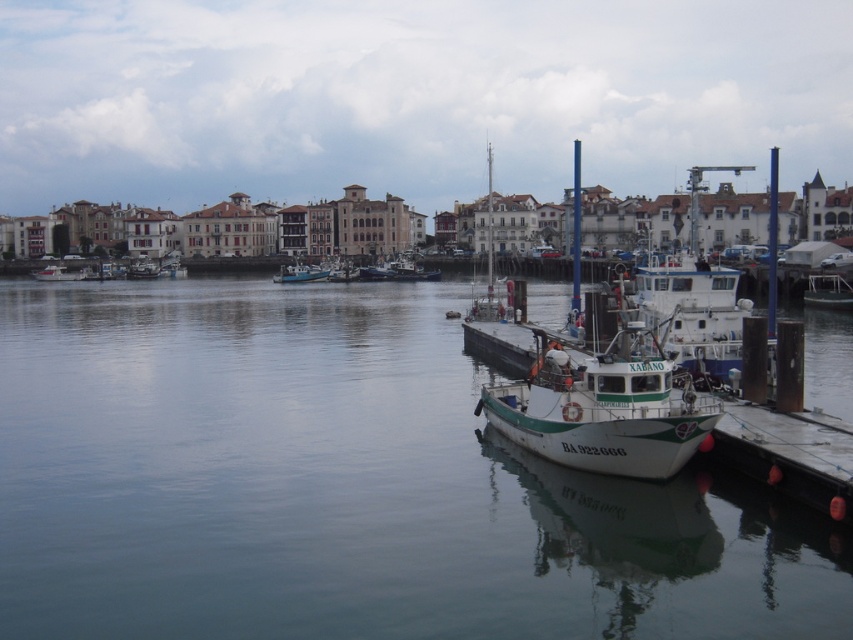
Is point (523, 428) farther from viewer compared to point (288, 276)?

No, it is not.

Where is `white matte boat at center`? The width and height of the screenshot is (853, 640). white matte boat at center is located at coordinates (602, 403).

Find the location of a particular element. Image resolution: width=853 pixels, height=640 pixels. white matte boat at center is located at coordinates (602, 403).

Is green matte boat at right smaller than white glossy boat at left?

Correct, green matte boat at right occupies less space than white glossy boat at left.

Is green matte boat at right positioned behind white glossy boat at left?

No, it is not.

The width and height of the screenshot is (853, 640). What are the coordinates of `green matte boat at right` in the screenshot? It's located at (828, 291).

Between point (775, 618) and point (281, 273), which one is positioned in front?

Point (775, 618)

Does clear water at center appear on the left side of teal matte boat at center?

No, clear water at center is not to the left of teal matte boat at center.

Does point (724, 552) lie in front of point (302, 275)?

Yes, it is.

Where is `clear water at center`? clear water at center is located at coordinates (341, 484).